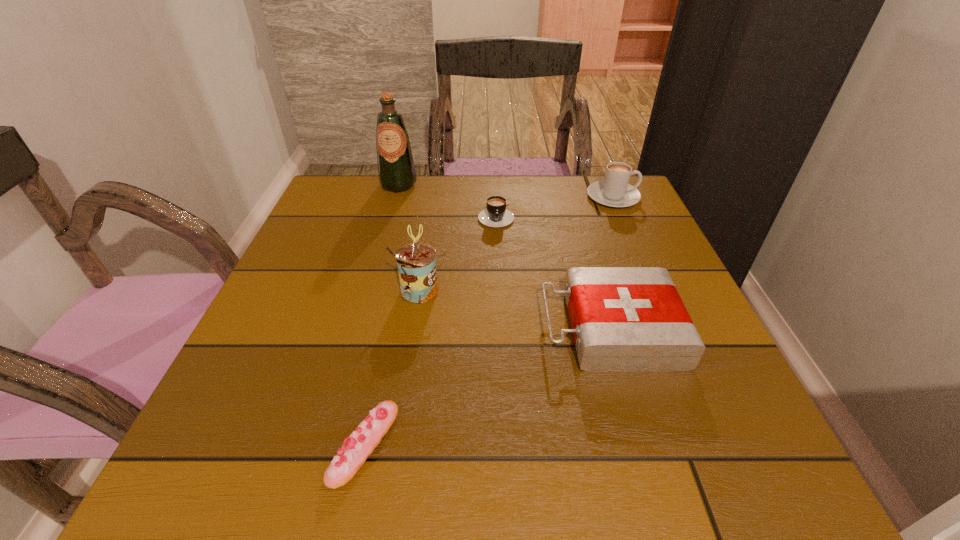
The width and height of the screenshot is (960, 540). In order to click on empty space between the tallest object and the eclair in this screenshot , I will do `click(381, 314)`.

Where is `free space between the third tallest object and the eclair`? This screenshot has height=540, width=960. free space between the third tallest object and the eclair is located at coordinates (489, 320).

Locate an element on the screen. The image size is (960, 540). free area in between the shortest object and the can is located at coordinates (392, 367).

At what (x,y) coordinates should I click in order to perform the action: click on free space between the tallest object and the third object from right to left. Please return your answer as a coordinate pair (x, y). The height and width of the screenshot is (540, 960). Looking at the image, I should click on (447, 200).

At what (x,y) coordinates should I click in order to perform the action: click on vacant space that is in between the fourth object from left to right and the right cappuccino. Please return your answer as a coordinate pair (x, y). This screenshot has height=540, width=960. Looking at the image, I should click on (555, 206).

Find the location of `vacant region between the second shortest object and the tallest object`. vacant region between the second shortest object and the tallest object is located at coordinates (447, 200).

This screenshot has width=960, height=540. Identify the location of blank region between the tallest object and the left cappuccino. (447, 200).

Find the location of `vacant region between the second tallest object and the shortest object`. vacant region between the second tallest object and the shortest object is located at coordinates (392, 367).

Locate an element on the screen. object that is the second closest to the can is located at coordinates 624,319.

Choose which object is the nearest neighbor to the fifth shortest object. Please provide its 2D coordinates. Your answer should be formatted as a tuple, i.e. [(x, y)], where the tuple contains the x and y coordinates of a point satisfying the conditions above.

[(496, 215)]